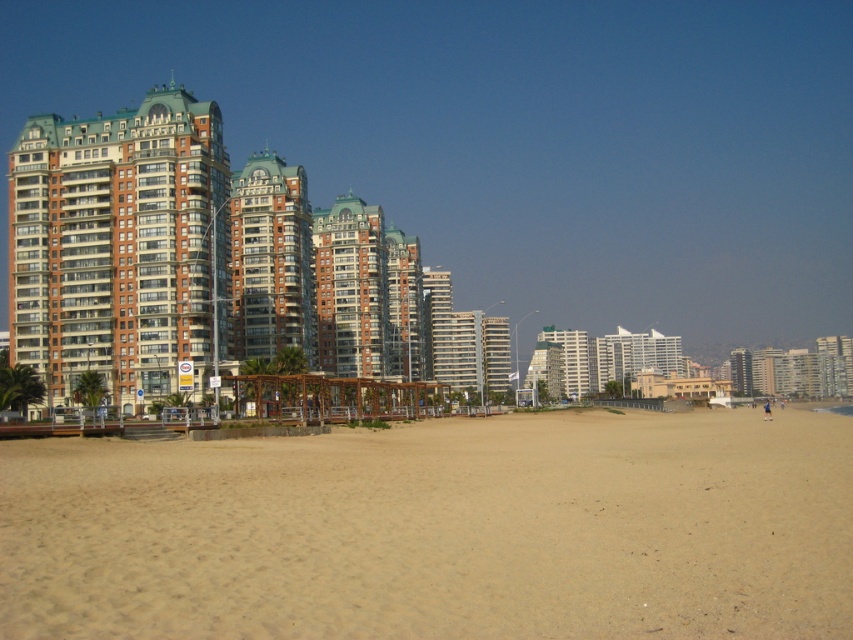
Question: Which point is closer to the camera?

Choices:
 (A) (71, 449)
 (B) (109, 256)
 (C) (381, 365)

Answer: (A)

Question: Considering the relative positions of brown sandy beach at lower center and brick textured building at left in the image provided, where is brown sandy beach at lower center located with respect to brick textured building at left?

Choices:
 (A) left
 (B) right

Answer: (B)

Question: Does brick textured building at left lie behind brown brick building at left?

Choices:
 (A) no
 (B) yes

Answer: (B)

Question: Which point is farther to the camera?

Choices:
 (A) brown sandy beach at lower center
 (B) brown brick building at left
 (C) brick textured building at left

Answer: (C)

Question: Which of the following is the closest to the observer?

Choices:
 (A) (579, 570)
 (B) (126, 372)

Answer: (A)

Question: Can you confirm if brown sandy beach at lower center is wider than brown brick building at left?

Choices:
 (A) yes
 (B) no

Answer: (A)